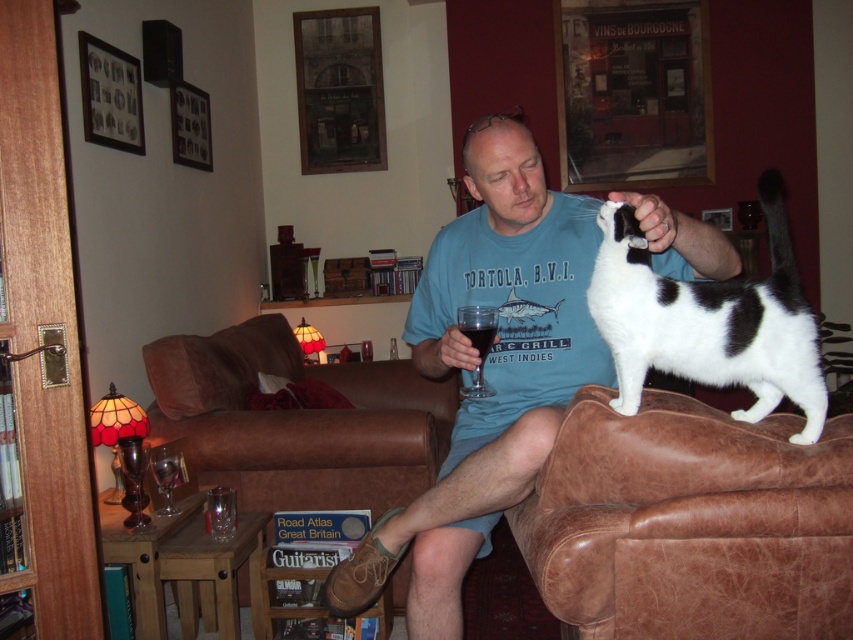
Is black and white fur at upper right shorter than clear glass at center?

In fact, black and white fur at upper right may be taller than clear glass at center.

I want to click on black and white fur at upper right, so (708, 320).

The width and height of the screenshot is (853, 640). Identify the location of black and white fur at upper right. (708, 320).

Is transparent glass at right to the left of clear glass at center from the viewer's perspective?

Correct, you'll find transparent glass at right to the left of clear glass at center.

Between point (477, 364) and point (485, 356), which one is positioned in front?

Point (477, 364) is in front.

Where is `transparent glass at right`? Image resolution: width=853 pixels, height=640 pixels. transparent glass at right is located at coordinates (477, 346).

This screenshot has width=853, height=640. What do you see at coordinates (489, 368) in the screenshot?
I see `blue cotton shirt at center` at bounding box center [489, 368].

Between blue cotton shirt at center and brown leather couch at center, which one is positioned lower?

brown leather couch at center

Identify the location of blue cotton shirt at center. The height and width of the screenshot is (640, 853). (489, 368).

In order to click on blue cotton shirt at center in this screenshot , I will do `click(489, 368)`.